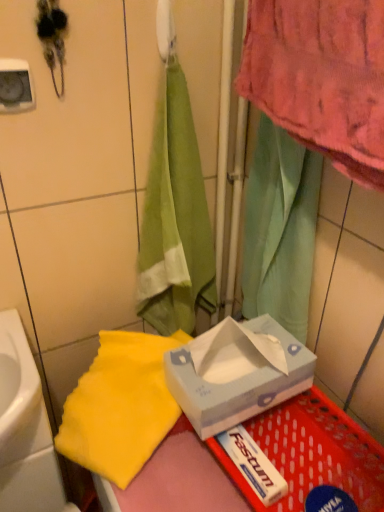
This screenshot has height=512, width=384. In order to click on empty space that is ontop of white plastic basket at lower right in this screenshot , I will do `click(268, 458)`.